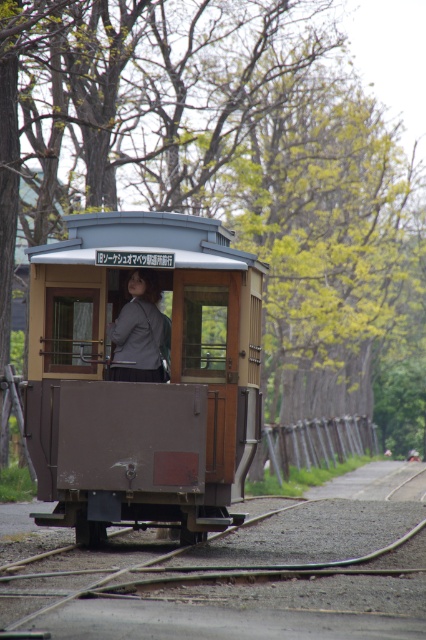
Question: Does brown wooden train car at center appear on the left side of matte gray blazer at center?

Choices:
 (A) yes
 (B) no

Answer: (B)

Question: Is brown wooden train car at center behind matte gray blazer at center?

Choices:
 (A) yes
 (B) no

Answer: (B)

Question: Which of the following is the closest to the observer?

Choices:
 (A) (135, 316)
 (B) (207, 269)

Answer: (B)

Question: Is brown wooden train car at center below matte gray blazer at center?

Choices:
 (A) yes
 (B) no

Answer: (A)